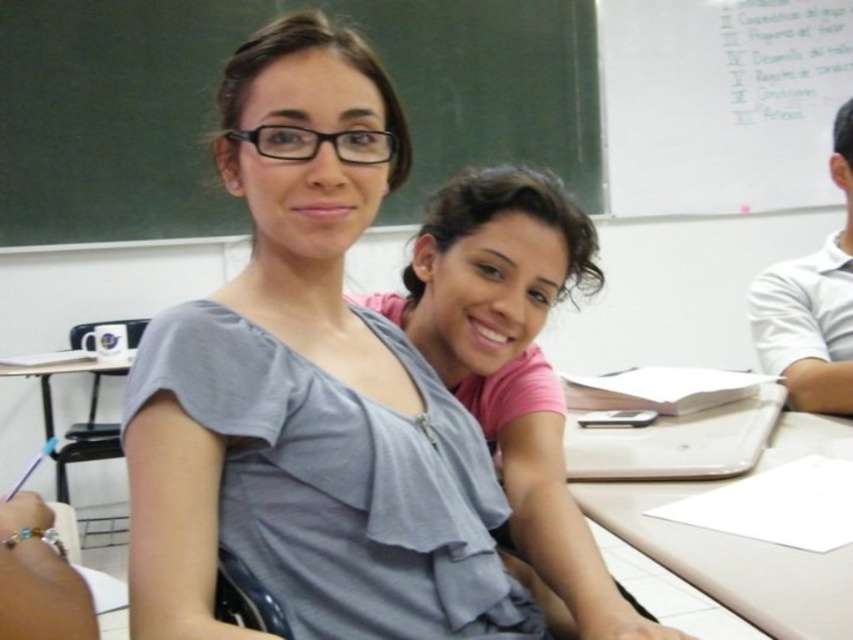
Is white shirt at right positioned in front of metallic silver table at left?

Yes, white shirt at right is in front of metallic silver table at left.

Can you confirm if white shirt at right is taller than metallic silver table at left?

Indeed, white shirt at right has a greater height compared to metallic silver table at left.

Find the location of a particular element. The width and height of the screenshot is (853, 640). white shirt at right is located at coordinates (811, 305).

Does pink matte shirt at center have a smaller size compared to white shirt at right?

No, pink matte shirt at center is not smaller than white shirt at right.

Is pink matte shirt at center thinner than white shirt at right?

No, pink matte shirt at center is not thinner than white shirt at right.

What do you see at coordinates (514, 365) in the screenshot? I see `pink matte shirt at center` at bounding box center [514, 365].

Find the location of `pink matte shirt at center`. pink matte shirt at center is located at coordinates (514, 365).

Between white plastic table at center and metallic silver table at left, which one appears on the left side from the viewer's perspective?

Positioned to the left is metallic silver table at left.

Consider the image. Which of these two, white plastic table at center or metallic silver table at left, stands shorter?

Standing shorter between the two is white plastic table at center.

Is point (817, 604) less distant than point (94, 385)?

Yes, point (817, 604) is closer to viewer.

The width and height of the screenshot is (853, 640). Find the location of `white plastic table at center`. white plastic table at center is located at coordinates (717, 531).